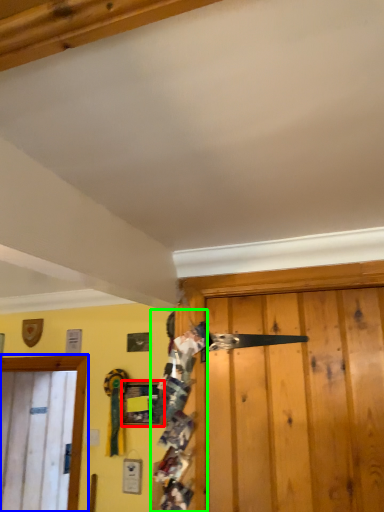
Question: Which object is the farthest from picture frame (highlighted by a red box)? Choose among these: door (highlighted by a blue box) or person (highlighted by a green box).

Choices:
 (A) door
 (B) person

Answer: (B)